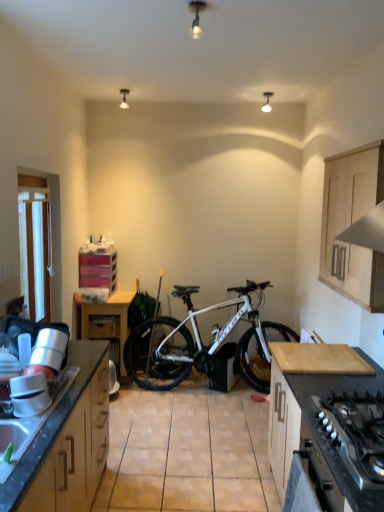
The image size is (384, 512). Describe the element at coordinates (108, 314) in the screenshot. I see `wooden table at center` at that location.

The width and height of the screenshot is (384, 512). What do you see at coordinates (356, 434) in the screenshot? I see `black matte gas stove at lower right` at bounding box center [356, 434].

Image resolution: width=384 pixels, height=512 pixels. Find the location of `black matte gas stove at lower right`. black matte gas stove at lower right is located at coordinates (356, 434).

Image resolution: width=384 pixels, height=512 pixels. What do you see at coordinates (104, 326) in the screenshot?
I see `matte plastic drawer at center` at bounding box center [104, 326].

From the picture: Measure the distance between point (383,273) and camera.

2.00 meters.

Identify the location of granite gray sink at lower left. (29, 426).

Is black matte gas stove at lower right oriented away from wooden cabinet at left, the 2th cabinetry positioned from the left?

No, black matte gas stove at lower right is not facing away from wooden cabinet at left, the 2th cabinetry positioned from the left.

Which of these two, black matte gas stove at lower right or wooden cabinet at left, the 4th cabinetry positioned from the back, is thinner?

With smaller width is black matte gas stove at lower right.

Does black matte gas stove at lower right come behind wooden cabinet at left, the first cabinetry viewed from the front?

Yes, black matte gas stove at lower right is further from the camera.

Measure the distance from black matte gas stove at lower right to wooden cabinet at left, the first cabinetry viewed from the front.

black matte gas stove at lower right is 4.02 feet from wooden cabinet at left, the first cabinetry viewed from the front.

Between light wood countertop at lower right, acting as the 2th cabinetry starting from the back, and black matte gas stove at lower right, which one has less height?

Standing shorter between the two is black matte gas stove at lower right.

Is light wood countertop at lower right, the 3th cabinetry in the front-to-back sequence, positioned beyond the bounds of black matte gas stove at lower right?

Yes, light wood countertop at lower right, the 3th cabinetry in the front-to-back sequence, is not within black matte gas stove at lower right.

Is light wood countertop at lower right, the 3th cabinetry in the front-to-back sequence, not close to black matte gas stove at lower right?

light wood countertop at lower right, the 3th cabinetry in the front-to-back sequence, is actually quite close to black matte gas stove at lower right.

How many degrees apart are the facing directions of light wood countertop at lower right, acting as the 2th cabinetry starting from the back, and black matte gas stove at lower right?

There is a 0.063-degree angle between the facing directions of light wood countertop at lower right, acting as the 2th cabinetry starting from the back, and black matte gas stove at lower right.

How many degrees apart are the facing directions of wooden table at center and granite gray sink at lower left?

The facing directions of wooden table at center and granite gray sink at lower left are 90.1 degrees apart.

Looking at this image, is wooden table at center aimed at granite gray sink at lower left?

Yes, wooden table at center faces towards granite gray sink at lower left.

Between wooden table at center and granite gray sink at lower left, which one appears on the right side from the viewer's perspective?

granite gray sink at lower left.

I want to click on sink in front of the wooden table at center, so click(29, 426).

Is wooden cabinet at left, the 2th cabinetry positioned from the left, completely or partially inside granite gray sink at lower left?

No, wooden cabinet at left, the 2th cabinetry positioned from the left, is not surrounded by granite gray sink at lower left.

Which of these two, granite gray sink at lower left or wooden cabinet at left, the first cabinetry viewed from the front, is smaller?

Smaller between the two is granite gray sink at lower left.

Is granite gray sink at lower left not near wooden cabinet at left, the 2th cabinetry positioned from the left?

No.

Is granite gray sink at lower left shorter than wooden cabinet at left, the first cabinetry viewed from the front?

Correct, granite gray sink at lower left is not as tall as wooden cabinet at left, the first cabinetry viewed from the front.

Considering the points (326, 197) and (250, 365), which point is in front, point (326, 197) or point (250, 365)?

The point (326, 197) is in front.

Can you confirm if light wood cabinet at upper right, the 3th cabinetry in the back-to-front sequence, is positioned to the left of white matte bicycle at center?

Result: Incorrect, light wood cabinet at upper right, the 3th cabinetry in the back-to-front sequence, is not on the left side of white matte bicycle at center.

I want to click on bicycle that appears below the light wood cabinet at upper right, the 2th cabinetry in the front-to-back sequence (from the image's perspective), so click(201, 343).

From the image's perspective, which is below, light wood cabinet at upper right, which is the first cabinetry from right to left, or white matte bicycle at center?

white matte bicycle at center appears lower in the image.

Would you say black matte gas stove at lower right is inside or outside light wood cabinet at upper right, the 3th cabinetry in the back-to-front sequence?

black matte gas stove at lower right is not inside light wood cabinet at upper right, the 3th cabinetry in the back-to-front sequence, it's outside.

Which is behind, point (342, 434) or point (340, 157)?

The point (340, 157) is farther from the camera.

How different are the orientations of black matte gas stove at lower right and light wood cabinet at upper right, the 2th cabinetry in the front-to-back sequence, in degrees?

They differ by 1.21 degrees in their facing directions.

Is black matte gas stove at lower right oriented away from light wood cabinet at upper right, the fourth cabinetry from the left?

black matte gas stove at lower right does not have its back to light wood cabinet at upper right, the fourth cabinetry from the left.

Is white matte bicycle at center oriented away from pink plastic drawers at center left, the 1th cabinetry viewed from the left?

No, white matte bicycle at center is not facing the opposite direction of pink plastic drawers at center left, the 1th cabinetry viewed from the left.

Between white matte bicycle at center and pink plastic drawers at center left, marked as the 4th cabinetry in a right-to-left arrangement, which one has more height?

white matte bicycle at center.

How much distance is there between white matte bicycle at center and pink plastic drawers at center left, marked as the 4th cabinetry in a right-to-left arrangement?

They are 1.10 meters apart.

From a real-world perspective, which is physically below, white matte bicycle at center or pink plastic drawers at center left, marked as the 4th cabinetry in a right-to-left arrangement?

From a 3D spatial view, white matte bicycle at center is below.

Locate an element on the screen. This screenshot has width=384, height=512. gas stove behind the wooden cabinet at left, the first cabinetry viewed from the front is located at coordinates (356, 434).

The height and width of the screenshot is (512, 384). I want to click on gas stove above the light wood countertop at lower right, the third cabinetry viewed from the left (from the image's perspective), so click(356, 434).

Which object lies further to the anchor point black matte gas stove at lower right, white matte bicycle at center or wooden table at center?

wooden table at center lies further to black matte gas stove at lower right than the other object.

Estimate the real-world distances between objects in this image. Which object is further from matte plastic drawer at center, granite gray sink at lower left or black matte gas stove at lower right?

black matte gas stove at lower right is positioned further to the anchor matte plastic drawer at center.

From the picture: Which object lies further to the anchor point wooden cabinet at left, the 2th cabinetry positioned from the left, granite gray sink at lower left or matte plastic drawer at center?

The object further to wooden cabinet at left, the 2th cabinetry positioned from the left, is matte plastic drawer at center.

Looking at the image, which one is located closer to light wood cabinet at upper right, the 2th cabinetry in the front-to-back sequence, white matte bicycle at center or light wood countertop at lower right, the third cabinetry viewed from the left?

light wood countertop at lower right, the third cabinetry viewed from the left.

Looking at the image, which one is located closer to wooden cabinet at left, the 4th cabinetry positioned from the back, white fabric at left or light wood cabinet at upper right, the 3th cabinetry in the back-to-front sequence?

white fabric at left lies closer to wooden cabinet at left, the 4th cabinetry positioned from the back, than the other object.

Which object lies further to the anchor point black matte gas stove at lower right, matte plastic drawer at center or white matte bicycle at center?

Among the two, matte plastic drawer at center is located further to black matte gas stove at lower right.

Based on their spatial positions, is light wood cabinet at upper right, the fourth cabinetry from the left, or light wood countertop at lower right, positioned as the second cabinetry in right-to-left order, closer to pink plastic drawers at center left, the 1th cabinetry viewed from the back?

light wood countertop at lower right, positioned as the second cabinetry in right-to-left order, lies closer to pink plastic drawers at center left, the 1th cabinetry viewed from the back, than the other object.

Consider the image. When comparing their distances from white matte bicycle at center, does matte plastic drawer at center or white fabric at left seem further?

The object further to white matte bicycle at center is white fabric at left.

Where is `cabinetry located between granite gray sink at lower left and light wood countertop at lower right, the third cabinetry viewed from the left, in the left-right direction`? cabinetry located between granite gray sink at lower left and light wood countertop at lower right, the third cabinetry viewed from the left, in the left-right direction is located at coordinates (52, 422).

Identify the location of window screen located between black matte gas stove at lower right and pink plastic drawers at center left, marked as the 4th cabinetry in a right-to-left arrangement, in the depth direction. This screenshot has height=512, width=384. (35, 250).

You are a GUI agent. You are given a task and a screenshot of the screen. Output one action in this format:
    pyautogui.click(x=<x>, y=<y>)
    Task: Click on the bicycle between light wood cabinet at upper right, the 3th cabinetry in the back-to-front sequence, and matte plastic drawer at center, along the z-axis
    
    Given the screenshot: What is the action you would take?
    pyautogui.click(x=201, y=343)

Image resolution: width=384 pixels, height=512 pixels. I want to click on table located between light wood countertop at lower right, the third cabinetry viewed from the left, and matte plastic drawer at center in the depth direction, so click(x=108, y=314).